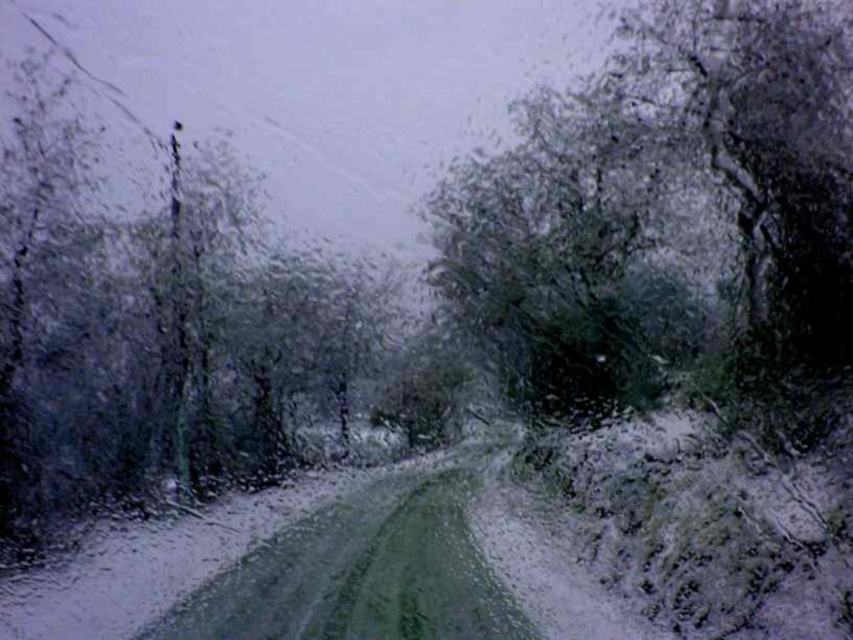
You are a photographer trying to capture the two trees outside the window. Which tree, the green matte tree at upper right or the glossy dark green tree at upper left, would appear shorter in your photo?

The green matte tree at upper right is shorter than the glossy dark green tree at upper left, so it would appear shorter in the photo.